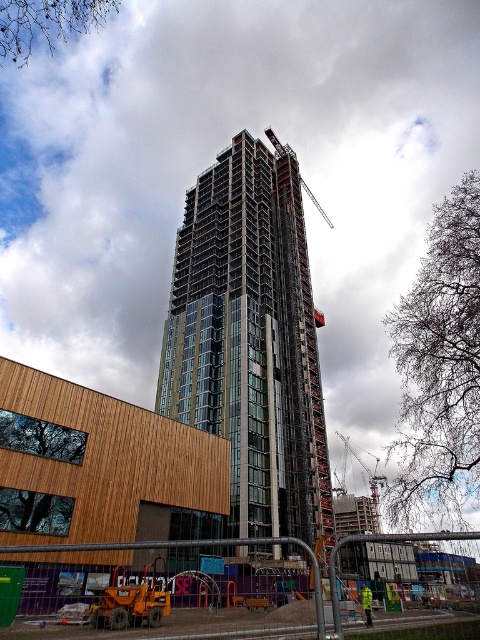
You are a safety inspector standing at the edge of the construction site. You notice the glassy steel building at center and the yellow reflective jacket at center. Based on their sizes, which object would you estimate is more likely to require a larger safety perimeter?

The glassy steel building at center might be wider than yellow reflective jacket at center, so it would likely require a larger safety perimeter.

You are a construction worker standing at the fenced area in the foreground. You need to place a 2m tall safety barrier between point (334, 563) and point (340, 435). Which point should the barrier be closer to ensure it doesn not block the camera view?

The barrier should be placed closer to point (340, 435) because point (334, 563) is closer to the camera. Placing the barrier closer to the farther point will keep it out of the camera view.

You are a construction worker standing at the base of the residential building. You notice two points marked on the construction blueprint. The first point is labeled as point (177, 252), and the second is point (361, 588). Which point is closer to your current position?

Point (177, 252) is further to the camera than point (361, 588), so the point closer to your current position is point (361, 588).